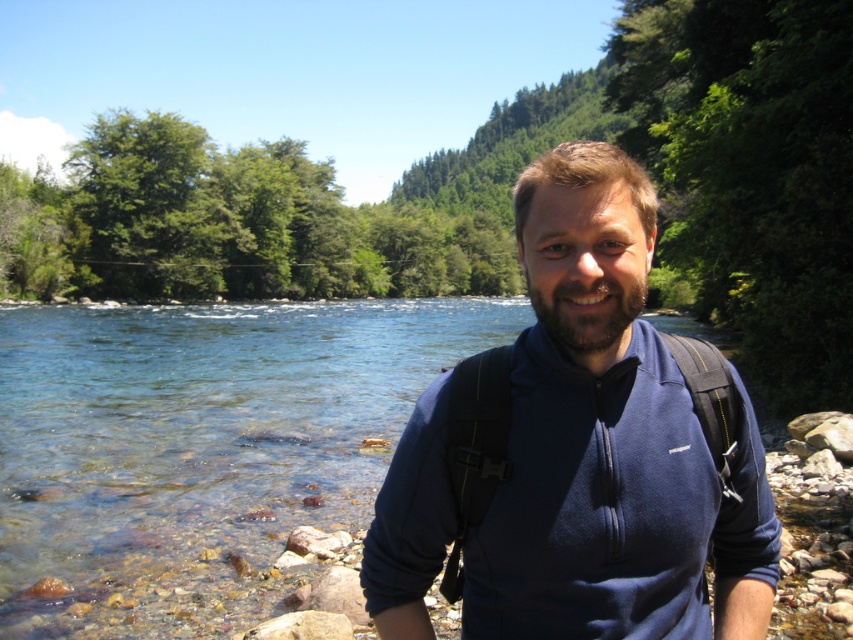
Is clear water at river right thinner than blue fleece jacket at center?

No.

In the scene shown: Does clear water at river right appear on the right side of blue fleece jacket at center?

Incorrect, clear water at river right is not on the right side of blue fleece jacket at center.

Measure the distance between clear water at river right and camera.

clear water at river right and camera are 16.51 feet apart.

The image size is (853, 640). I want to click on clear water at river right, so click(x=200, y=445).